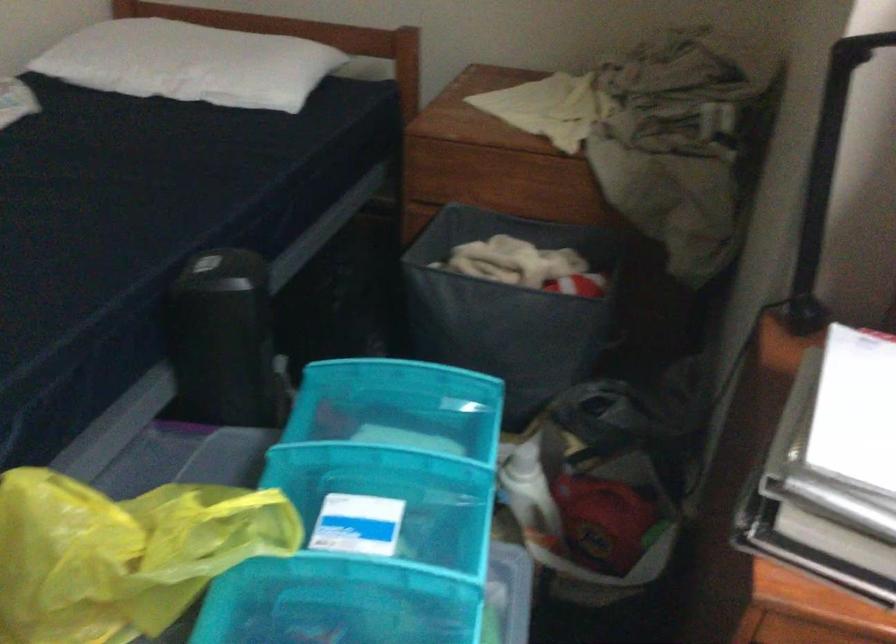
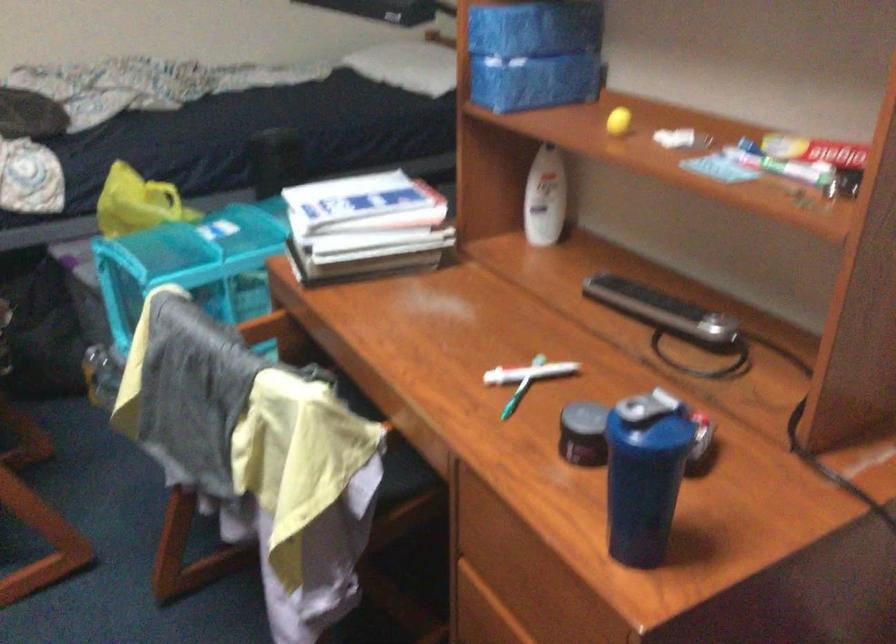
Question: I am providing you with two images of the same scene from different viewpoints. Please identify which objects are invisible in image2.

Choices:
 (A) blue drawer handle
 (B) white lotion bottle
 (C) pink toy ball
 (D) black remote control

Answer: (A)